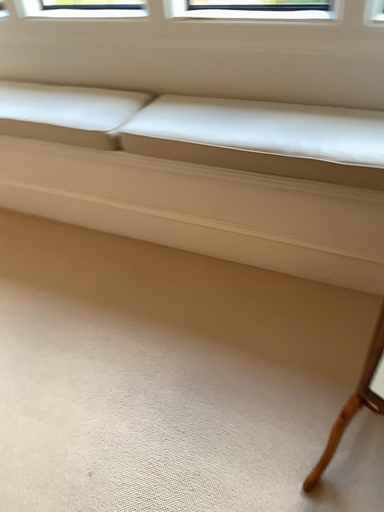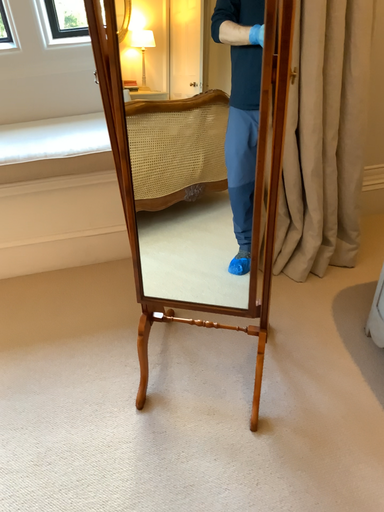
Question: Which way did the camera rotate in the video?

Choices:
 (A) rotated right
 (B) rotated left

Answer: (A)